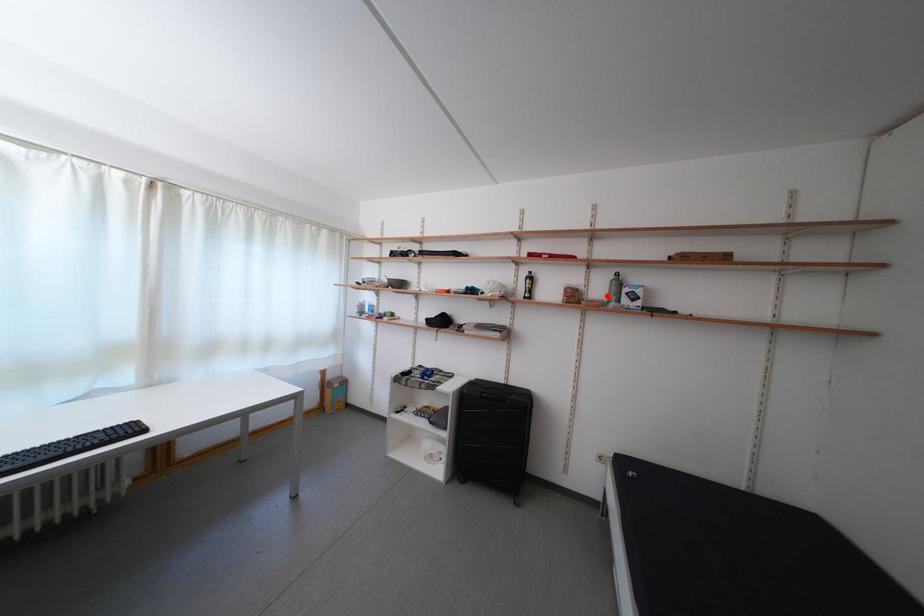
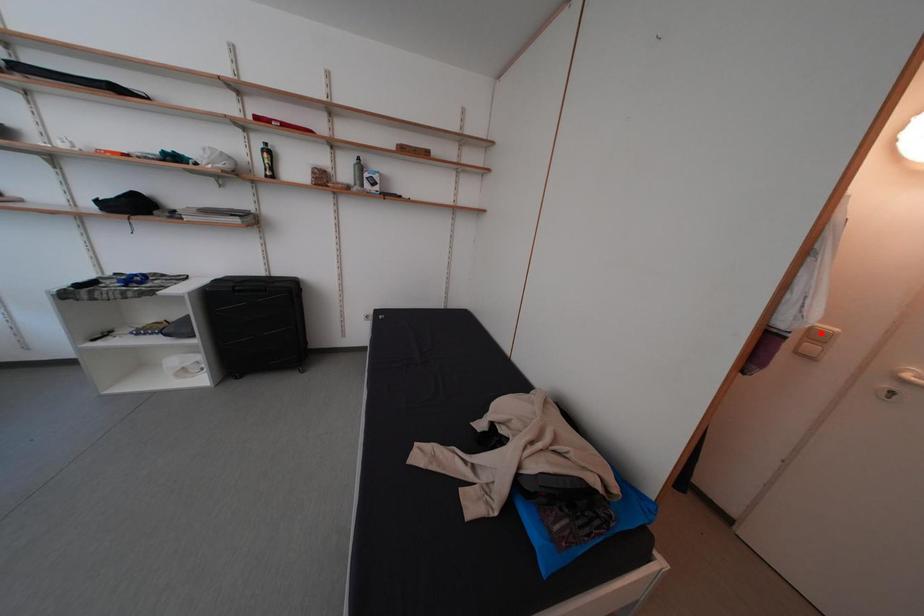
I am providing you with two images of the same scene from different viewpoints. A red point is marked on the first image and another point is marked on the second image. Does the point marked in image1 correspond to the same location as the one in image2?

No